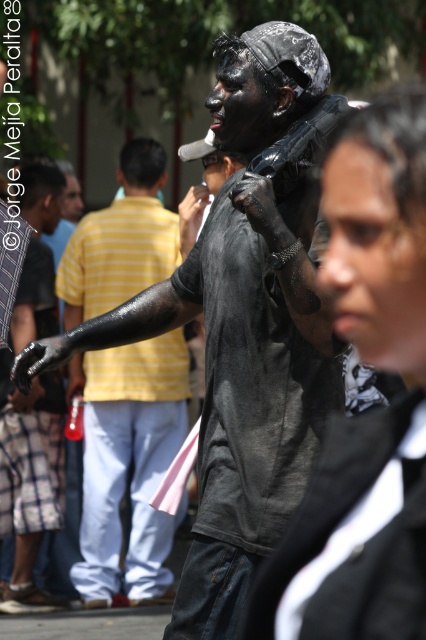
What is located at the coordinates point (365, 413) in the image?

The point (365, 413) corresponds to the matte black jacket at center.

You are a photographer trying to capture a closeup shot of the matte black jacket at center and the black matte body at center. Since you want to focus on both objects equally, which one should you adjust your camera focus towards first?

The matte black jacket at center has a smaller size compared to black matte body at center, so you should focus first on the matte black jacket at center to ensure both are in focus.